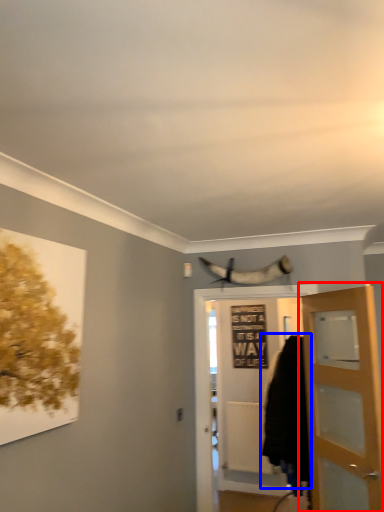
Question: Which object appears farthest to the camera in this image, door (highlighted by a red box) or cloak (highlighted by a blue box)?

Choices:
 (A) door
 (B) cloak

Answer: (B)